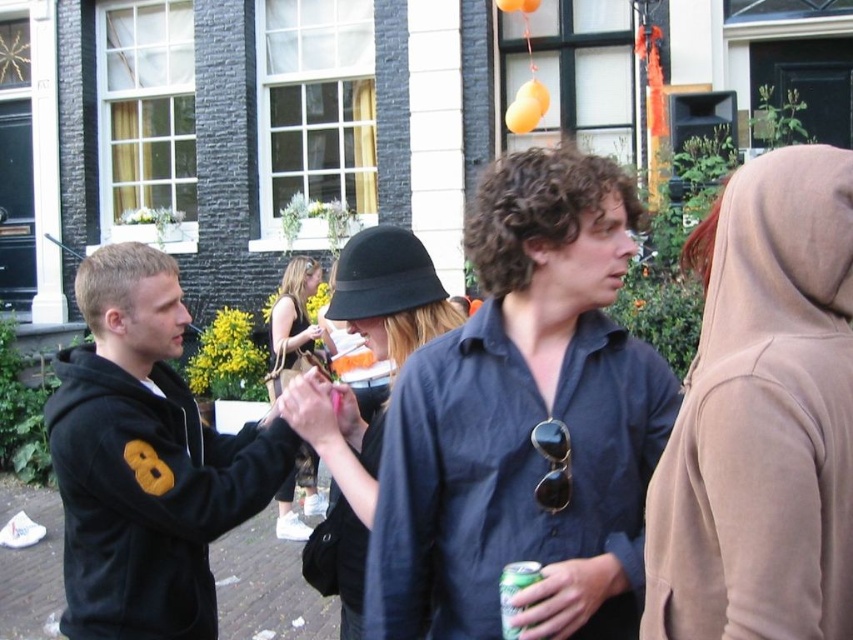
Can you confirm if black leather hat at center is positioned below green metallic can at center?

No.

Is black leather hat at center to the left of green metallic can at center from the viewer's perspective?

Indeed, black leather hat at center is positioned on the left side of green metallic can at center.

Find the location of a particular element. This screenshot has height=640, width=853. black leather hat at center is located at coordinates (293, 324).

Is beige fleece hoodie at right positioned before black felt hat at center?

Yes.

Is beige fleece hoodie at right smaller than black felt hat at center?

No.

Between point (811, 552) and point (347, 314), which one is positioned behind?

The point (347, 314) is behind.

Find the location of a particular element. beige fleece hoodie at right is located at coordinates (763, 420).

From the picture: Who is higher up, dark blue shirt at center or beige fleece hoodie at right?

beige fleece hoodie at right

Who is more distant from viewer, (614, 163) or (726, 320)?

The point (614, 163) is behind.

I want to click on dark blue shirt at center, so click(x=525, y=422).

Find the location of a particular element. This screenshot has width=853, height=640. dark blue shirt at center is located at coordinates (525, 422).